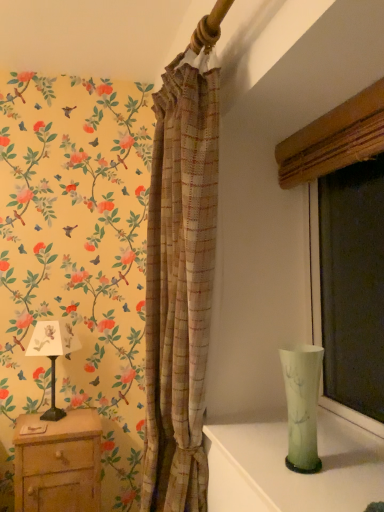
Question: From the image's perspective, is green translucent vase at right located above or below matte wood window frame at right?

Choices:
 (A) below
 (B) above

Answer: (A)

Question: Is green translucent vase at right wider or thinner than matte wood window frame at right?

Choices:
 (A) thin
 (B) wide

Answer: (A)

Question: Based on their relative distances, which object is nearer to the matte wood window frame at right?

Choices:
 (A) white paper lampshade at left
 (B) green translucent vase at right
 (C) plaid fabric curtain at center
 (D) wooden nightstand at lower left
 (E) green glass vase at lower right

Answer: (C)

Question: Which object is the closest to the matte wood window frame at right?

Choices:
 (A) green glass vase at lower right
 (B) white paper lampshade at left
 (C) wooden nightstand at lower left
 (D) green translucent vase at right
 (E) plaid fabric curtain at center

Answer: (E)